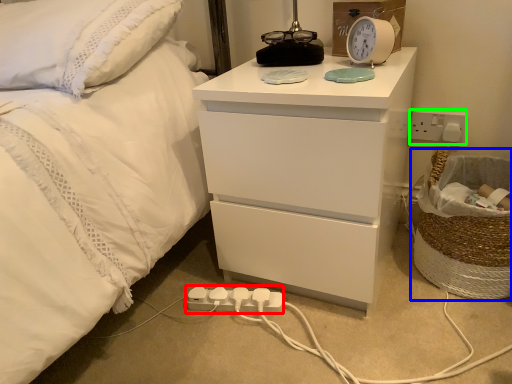
Question: Which object is positioned closest to extension cord (highlighted by a red box)? Select from laundry basket (highlighted by a blue box) and electric outlet (highlighted by a green box).

Choices:
 (A) laundry basket
 (B) electric outlet

Answer: (A)